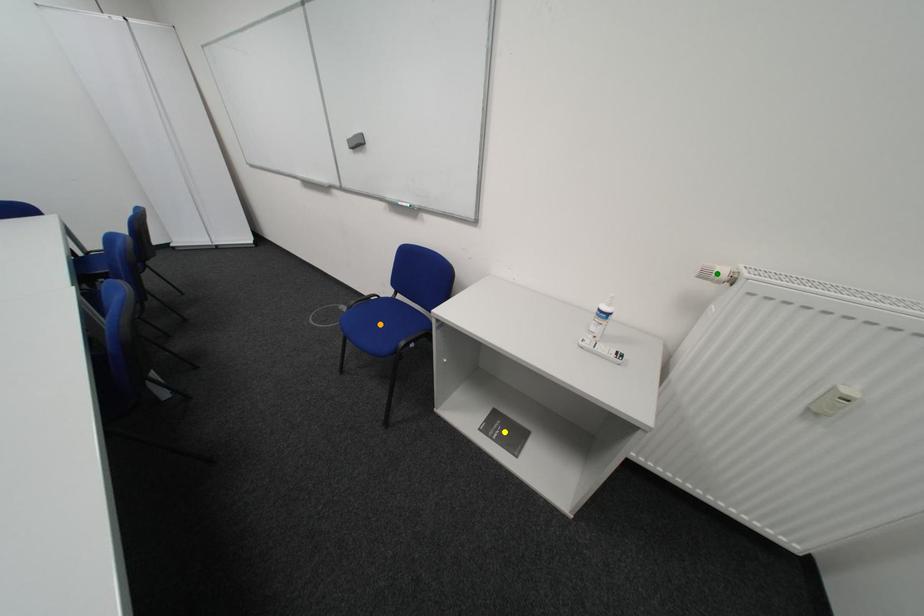
Order these from nearest to farthest:
A) orange point
B) green point
C) yellow point

green point → orange point → yellow point